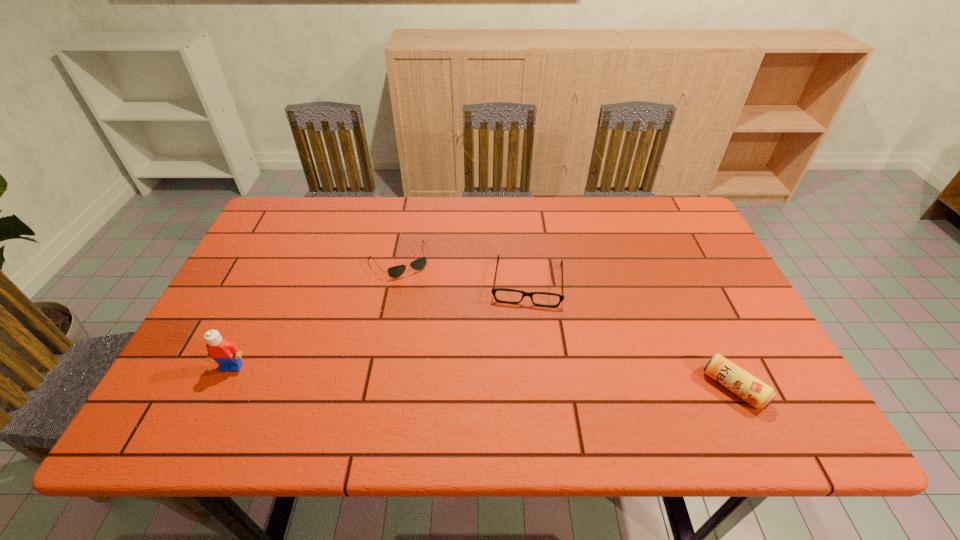
You are a GUI agent. You are given a task and a screenshot of the screen. Output one action in this format:
    pyautogui.click(x=<x>, y=<y>)
    Task: Click on the vacant space that satisfies the following two spatial constraints: 1. on the front side of the sunglasses; 2. on the left side of the rightmost object
    The height and width of the screenshot is (540, 960).
    Given the screenshot: What is the action you would take?
    pyautogui.click(x=374, y=388)